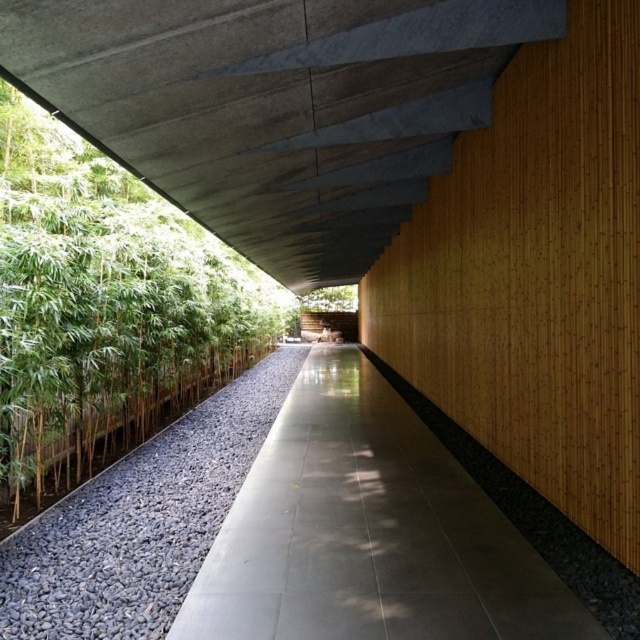
In the scene shown: Measure the distance from gray concrete path at center to black gravel at center.

gray concrete path at center and black gravel at center are 1.26 meters apart.

Who is taller, gray concrete path at center or black gravel at center?

gray concrete path at center

Find the location of `gray concrete path at center`. gray concrete path at center is located at coordinates (369, 532).

Between concrete ceiling at upper center and green leafy tree at center, which one appears on the right side from the viewer's perspective?

From the viewer's perspective, green leafy tree at center appears more on the right side.

Between point (394, 19) and point (349, 292), which one is positioned in front?

Point (394, 19)

The image size is (640, 640). I want to click on concrete ceiling at upper center, so click(275, 106).

Is green bamboo at left wider than black gravel at center?

No, green bamboo at left is not wider than black gravel at center.

Does green bamboo at left have a lesser width compared to black gravel at center?

Yes, green bamboo at left is thinner than black gravel at center.

Find the location of a particular element. green bamboo at left is located at coordinates (104, 307).

I want to click on green bamboo at left, so click(x=104, y=307).